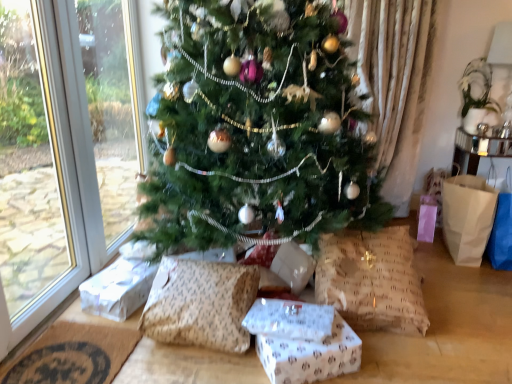
Question: Is point (97, 279) closer or farther from the camera than point (134, 334)?

Choices:
 (A) closer
 (B) farther

Answer: (B)

Question: From the image's perspective, relative to brown woven mat at lower left, is white paper gift at lower left, which ranks as the first gift box in left-to-right order, above or below?

Choices:
 (A) above
 (B) below

Answer: (A)

Question: Considering the real-world distances, which object is closest to the white paper gift at lower left, which ranks as the first gift box in left-to-right order?

Choices:
 (A) white paper gift at center, placed as the first gift box when sorted from right to left
 (B) burlap pillow at lower right, marked as the 2th pillow in a left-to-right arrangement
 (C) brown woven mat at lower left
 (D) brown textured pillow at lower center, which appears as the second pillow when viewed from the right
 (E) brown paper bag at right

Answer: (C)

Question: Estimate the real-world distances between objects in this image. Which object is closer to the green matte christmas tree at center?

Choices:
 (A) white paper gift at center, which appears as the 2th gift box when viewed from the back
 (B) brown woven mat at lower left
 (C) brown paper bag at right
 (D) brown textured pillow at lower center, which appears as the second pillow when viewed from the right
 (E) burlap pillow at lower right, marked as the 2th pillow in a left-to-right arrangement

Answer: (D)